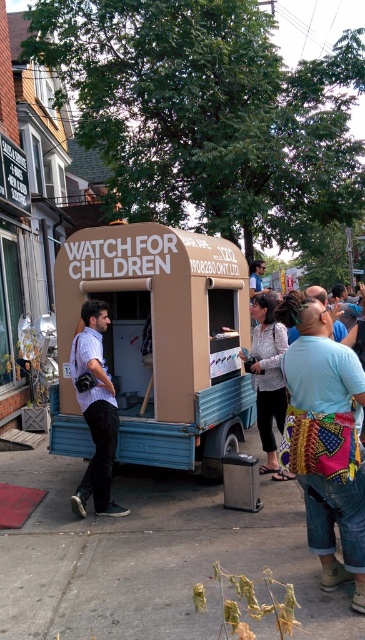
Does concrete sidewalk at lower center have a lesser height compared to brown cardboard food truck at center?

Correct, concrete sidewalk at lower center is not as tall as brown cardboard food truck at center.

Can you confirm if concrete sidewalk at lower center is positioned to the left of brown cardboard food truck at center?

Incorrect, concrete sidewalk at lower center is not on the left side of brown cardboard food truck at center.

Which is in front, point (319, 598) or point (228, 372)?

Point (319, 598) is more forward.

Image resolution: width=365 pixels, height=640 pixels. Identify the location of concrete sidewalk at lower center. [x=150, y=557].

Between concrete sidewalk at lower center and matte blue shirt at left, which one is positioned higher?

matte blue shirt at left is above.

Which is in front, point (101, 582) or point (97, 452)?

Positioned in front is point (101, 582).

In order to click on concrete sidewalk at lower center in this screenshot , I will do `click(150, 557)`.

Describe the element at coordinates (150, 557) in the screenshot. Image resolution: width=365 pixels, height=640 pixels. I see `concrete sidewalk at lower center` at that location.

Which is behind, point (194, 572) or point (292, 444)?

The point (194, 572) is more distant.

Is point (194, 554) farther from camera compared to point (286, 305)?

That is True.

Where is `concrete sidewalk at lower center`? concrete sidewalk at lower center is located at coordinates (150, 557).